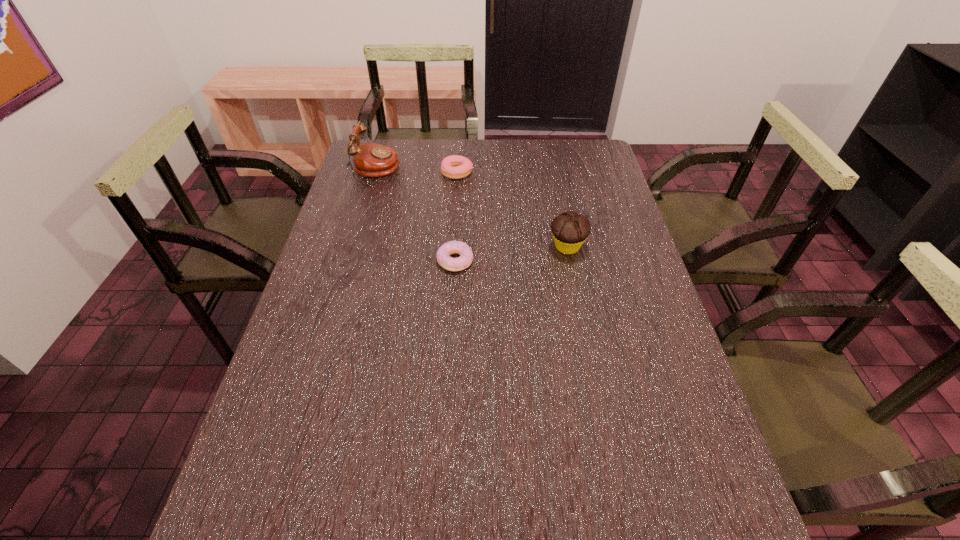
Locate an element on the screen. the tallest object is located at coordinates (373, 160).

You are a GUI agent. You are given a task and a screenshot of the screen. Output one action in this format:
    pyautogui.click(x=<x>, y=<y>)
    Task: Click on the telephone
    The image size is (960, 540).
    Given the screenshot: What is the action you would take?
    pyautogui.click(x=373, y=160)

I want to click on the second tallest object, so click(x=570, y=230).

Identify the location of the rightmost object. (570, 230).

Locate an element on the screen. the farther doughnut is located at coordinates (454, 167).

Image resolution: width=960 pixels, height=540 pixels. Identify the location of the nearer doughnut. (443, 254).

Locate an element on the screen. Image resolution: width=960 pixels, height=540 pixels. free space located on the dial of the leftmost object is located at coordinates click(x=420, y=170).

Where is `vacant space located on the front of the muffin`? vacant space located on the front of the muffin is located at coordinates (595, 384).

The height and width of the screenshot is (540, 960). In order to click on free space located on the right of the farther doughnut in this screenshot , I will do `click(542, 172)`.

You are a GUI agent. You are given a task and a screenshot of the screen. Output one action in this format:
    pyautogui.click(x=<x>, y=<y>)
    Task: Click on the vacant space located 0.210m on the front of the nearer doughnut
    The height and width of the screenshot is (540, 960).
    Given the screenshot: What is the action you would take?
    pyautogui.click(x=451, y=335)